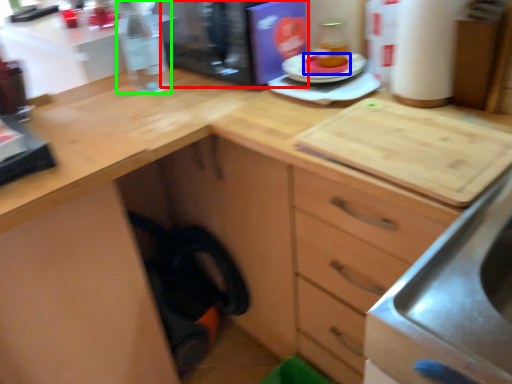
Question: Which object is the closest to the appliance (highlighted by a red box)? Choose among these: food (highlighted by a blue box) or bottle (highlighted by a green box).

Choices:
 (A) food
 (B) bottle

Answer: (B)